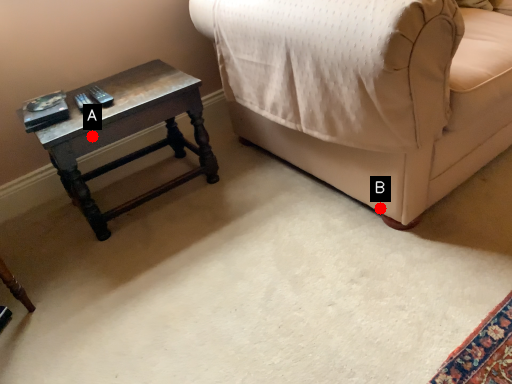
Question: Two points are circled on the image, labeled by A and B beside each circle. Which point is closer to the camera?

Choices:
 (A) A is closer
 (B) B is closer

Answer: (A)